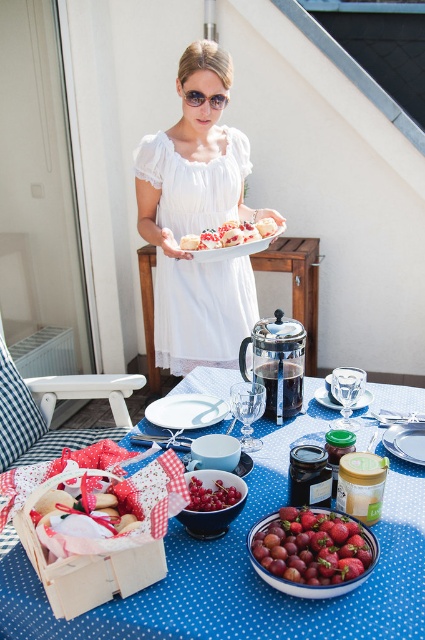
Between smooth white cake at center and glossy red grapes at center, which one has less height?

Standing shorter between the two is glossy red grapes at center.

Does smooth white cake at center have a greater width compared to glossy red grapes at center?

Indeed, smooth white cake at center has a greater width compared to glossy red grapes at center.

Identify the location of smooth white cake at center. This screenshot has height=640, width=425. (231, 234).

In the scene shown: Does blue polka dot tablecloth at center have a smaller size compared to shiny red strawberries at center?

No.

Between blue polka dot tablecloth at center and shiny red strawberries at center, which one appears on the left side from the viewer's perspective?

blue polka dot tablecloth at center

What do you see at coordinates (248, 572) in the screenshot? I see `blue polka dot tablecloth at center` at bounding box center [248, 572].

Identify the location of blue polka dot tablecloth at center. Image resolution: width=425 pixels, height=640 pixels. (248, 572).

At what (x,y) coordinates should I click in order to perform the action: click on transparent glass picnic table at center. Please return your answer as a coordinate pair (x, y). The width and height of the screenshot is (425, 640). Looking at the image, I should click on point(297,284).

Is transparent glass picnic table at center taller than glossy red grapes at center?

Indeed, transparent glass picnic table at center has a greater height compared to glossy red grapes at center.

You are a GUI agent. You are given a task and a screenshot of the screen. Output one action in this format:
    pyautogui.click(x=<x>, y=<y>)
    Task: Click on the transparent glass picnic table at center
    The height and width of the screenshot is (640, 425).
    Given the screenshot: What is the action you would take?
    pyautogui.click(x=297, y=284)